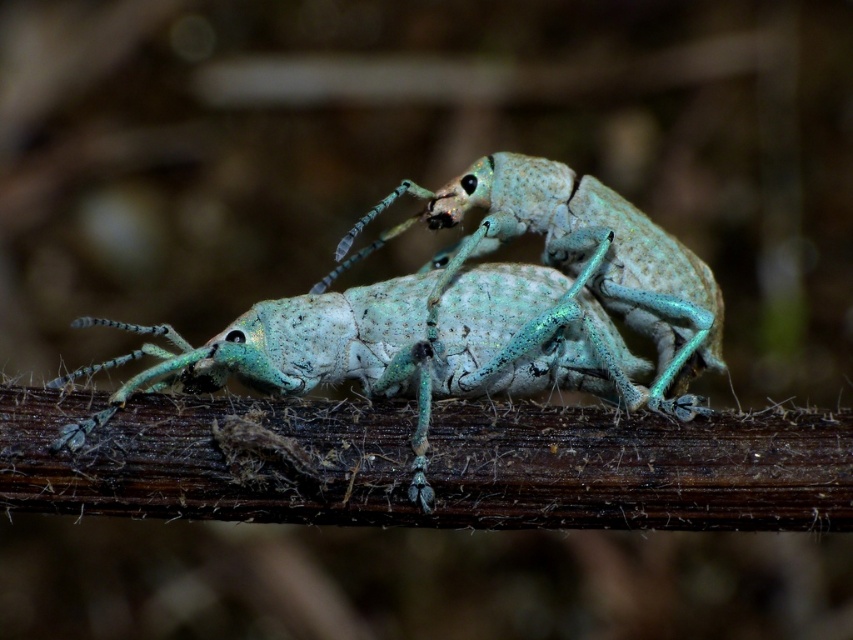
You are an entomologist observing two insects on a branch. You notice the matte green insect at center and the speckled light blue beetle at center. Which insect is positioned closer to your viewpoint?

The matte green insect at center is closer to the viewer than the speckled light blue beetle at center.

You are standing at the camera position and want to place a small sticker exactly at point (416, 496). If your hand can reach up to 1.2 meters, can you reach that point without moving your position?

The distance between point (416, 496) and the camera is 1.22 meters. Since your hand can only reach up to 1.2 meters, you cannot reach the point without moving.